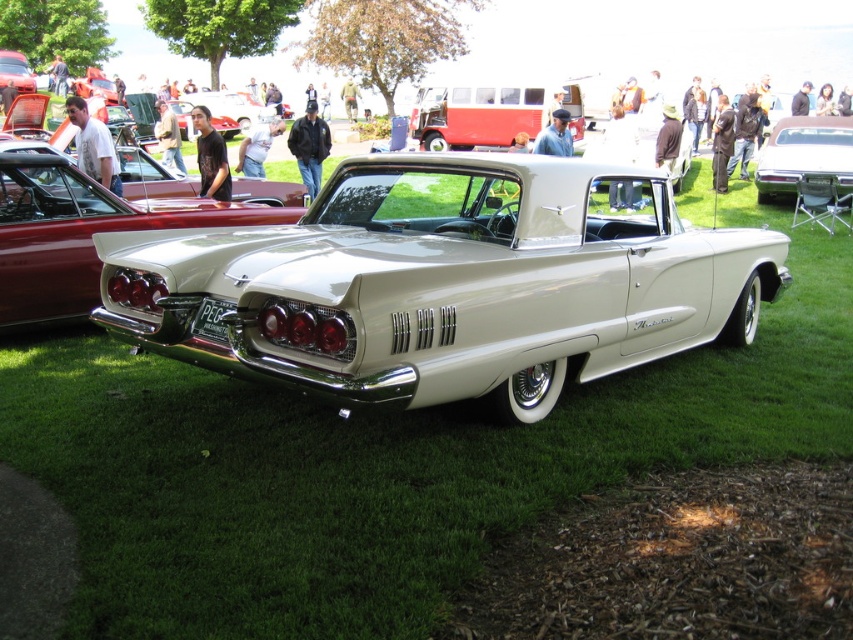
You are a photographer trying to capture both the shiny white convertible at center and the red matte van at upper center in a single frame. Based on their sizes, which vehicle should you position closer to the camera to ensure both fit in the shot?

Since the shiny white convertible at center is wider than the red matte van at upper center, you should position the shiny white convertible at center closer to the camera to ensure both fit in the shot.

You are a photographer at a car show. You need to decide whether to use a wide or standard lens to capture both the shiny white convertible at center and the shiny white car at center in the same frame. Given their height difference, which lens should you choose?

The shiny white convertible at center is taller than the shiny white car at center. To capture both in the same frame, a wide lens is recommended because it has a wider field of view, which can accommodate the height difference between the two vehicles.

You are a photographer at a car show and need to capture both the shiny white convertible at center and the shiny white car at center in a single shot. Which car should you focus on first to ensure both are in the frame?

You should focus on the shiny white convertible at center first since it is in front of the shiny white car at center, so by positioning the camera to include the front car, the one behind will naturally be in the frame as well.